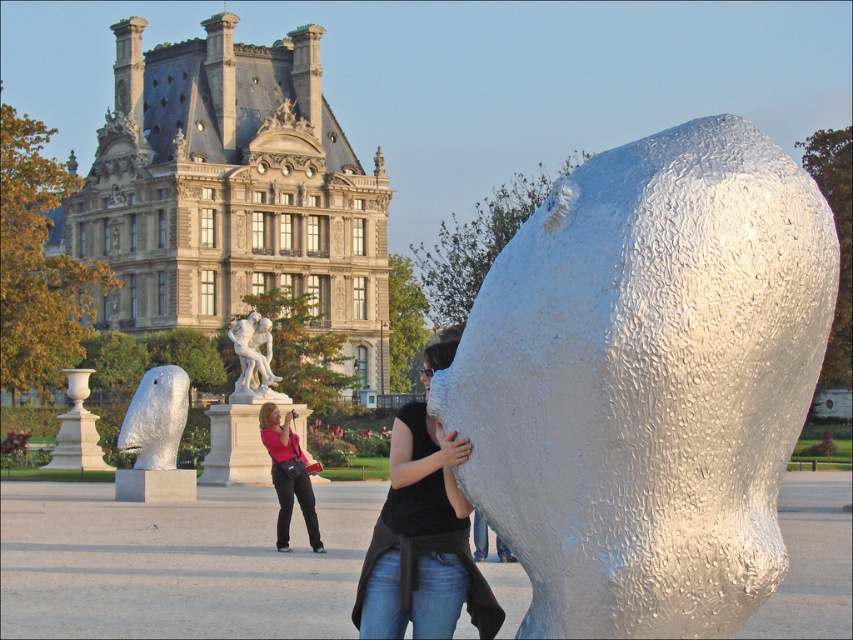
Question: Can you confirm if beige stone palace at upper left is smaller than matte pink shirt at center?

Choices:
 (A) no
 (B) yes

Answer: (A)

Question: Which point appears closest to the camera in this image?

Choices:
 (A) (270, 346)
 (B) (160, 403)
 (C) (439, 515)

Answer: (C)

Question: Observing the image, what is the correct spatial positioning of matte pink shirt at center in reference to white marble statue at center?

Choices:
 (A) above
 (B) below

Answer: (B)

Question: Considering the real-world distances, which object is closest to the white marble statue at center?

Choices:
 (A) metallic textured head at center
 (B) beige stone palace at upper left
 (C) silver textured head at left
 (D) matte pink shirt at center

Answer: (C)

Question: Does metallic textured head at center have a greater width compared to beige stone palace at upper left?

Choices:
 (A) yes
 (B) no

Answer: (B)

Question: Which point is farther from the camera taking this photo?

Choices:
 (A) (437, 592)
 (B) (584, 588)
 (C) (155, 316)
 (D) (289, 472)

Answer: (C)